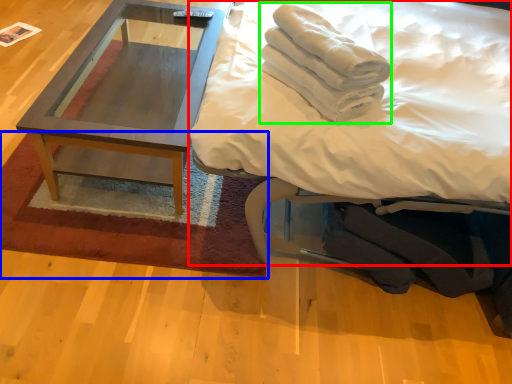
Question: Estimate the real-world distances between objects in this image. Which object is farther from bed (highlighted by a red box), mat (highlighted by a blue box) or material (highlighted by a green box)?

Choices:
 (A) mat
 (B) material

Answer: (A)